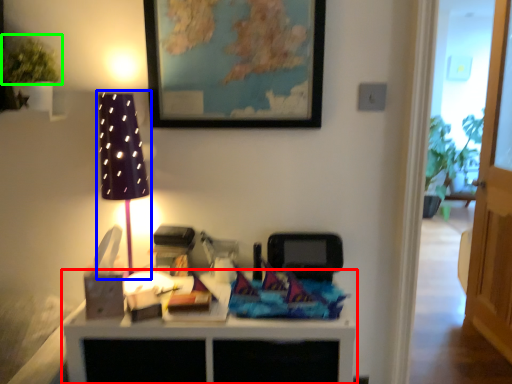
Question: Which is nearer to the table (highlighted by a red box)? table lamp (highlighted by a blue box) or plant (highlighted by a green box).

Choices:
 (A) table lamp
 (B) plant

Answer: (A)